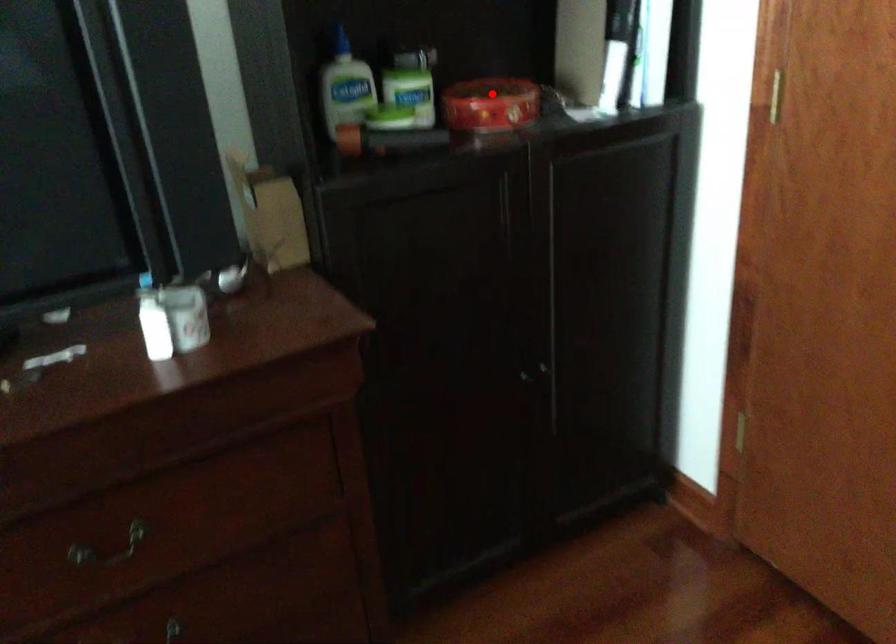
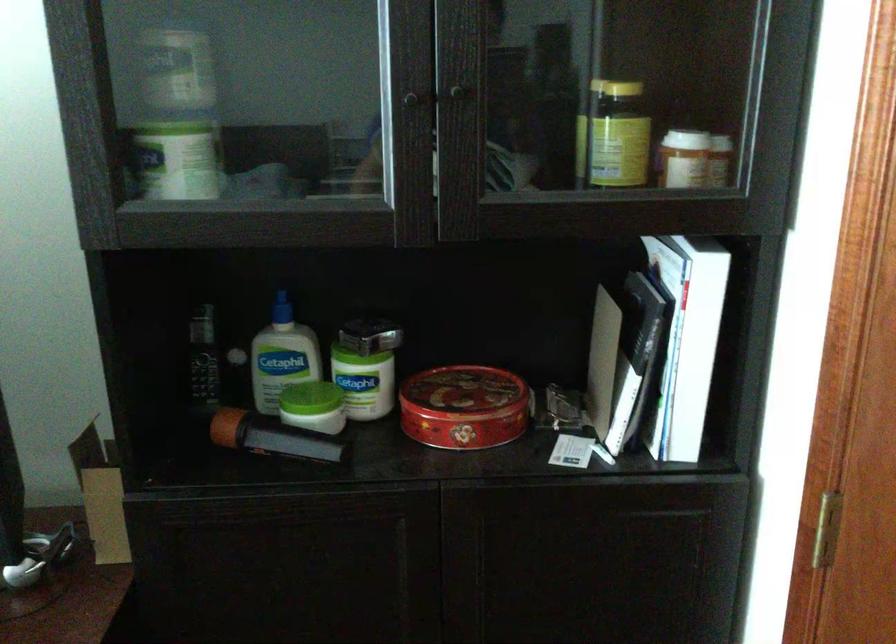
Question: I am providing you with two images of the same scene from different viewpoints. Image1 has a red point marked. In image2, the corresponding 3D location appears at what relative position? Reply with the corresponding letter.

Choices:
 (A) Closer
 (B) Farther

Answer: (A)